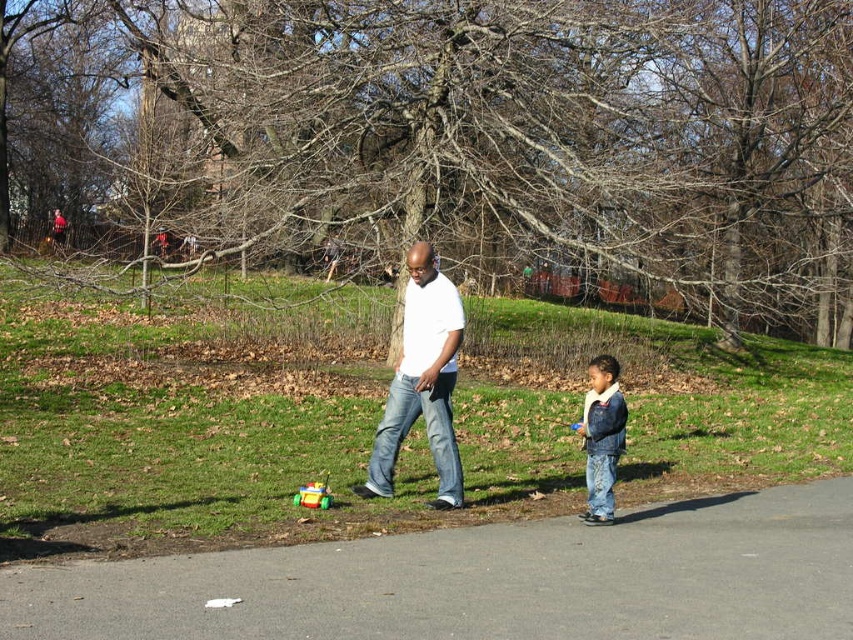
From the picture: Between green grass at center and gray asphalt pavement at lower center, which one has more height?

green grass at center

Which is above, green grass at center or gray asphalt pavement at lower center?

green grass at center is above.

Which is in front, point (328, 358) or point (798, 566)?

Positioned in front is point (798, 566).

You are a GUI agent. You are given a task and a screenshot of the screen. Output one action in this format:
    pyautogui.click(x=<x>, y=<y>)
    Task: Click on the green grass at center
    
    Given the screenshot: What is the action you would take?
    pyautogui.click(x=364, y=419)

Can you confirm if green grass at center is wider than denim jacket at lower right?

Correct, the width of green grass at center exceeds that of denim jacket at lower right.

Is point (154, 472) less distant than point (602, 417)?

No, (154, 472) is behind (602, 417).

The image size is (853, 640). Identify the location of green grass at center. 364,419.

Who is lower down, gray asphalt pavement at lower center or denim jacket at lower right?

gray asphalt pavement at lower center is lower down.

Can you confirm if gray asphalt pavement at lower center is thinner than denim jacket at lower right?

Incorrect, gray asphalt pavement at lower center's width is not less than denim jacket at lower right's.

At what (x,y) coordinates should I click in order to perform the action: click on gray asphalt pavement at lower center. Please return your answer as a coordinate pair (x, y). Image resolution: width=853 pixels, height=640 pixels. Looking at the image, I should click on (485, 580).